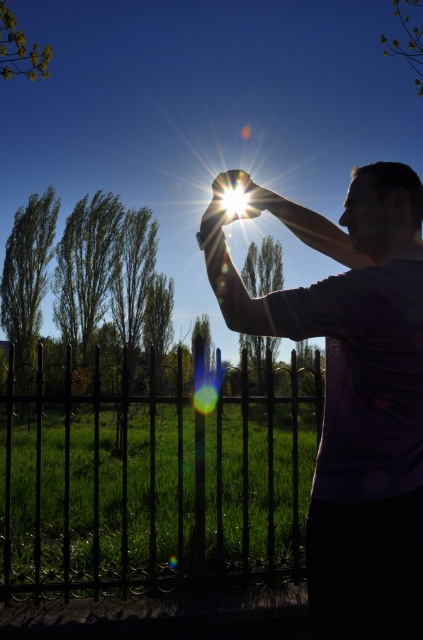
Question: Which point is closer to the camera?

Choices:
 (A) (408, 51)
 (B) (19, 29)

Answer: (A)

Question: Which of these objects is positioned farthest from the green leafy tree at upper right?

Choices:
 (A) black wrought iron fence at center
 (B) green leafy tree at left
 (C) green leafy tree at upper left
 (D) green leafy tree at center

Answer: (B)

Question: Can you confirm if purple matte shirt at upper right is thinner than green leafy tree at upper left?

Choices:
 (A) yes
 (B) no

Answer: (A)

Question: Does purple matte shirt at upper right have a lesser width compared to green leafy tree at left?

Choices:
 (A) no
 (B) yes

Answer: (B)

Question: Does green leafy tree at left have a lesser width compared to green leafy tree at upper right?

Choices:
 (A) no
 (B) yes

Answer: (B)

Question: Among these points, which one is nearest to the camera?

Choices:
 (A) (406, 24)
 (B) (65, 540)
 (C) (51, 221)
 (D) (274, 248)

Answer: (B)